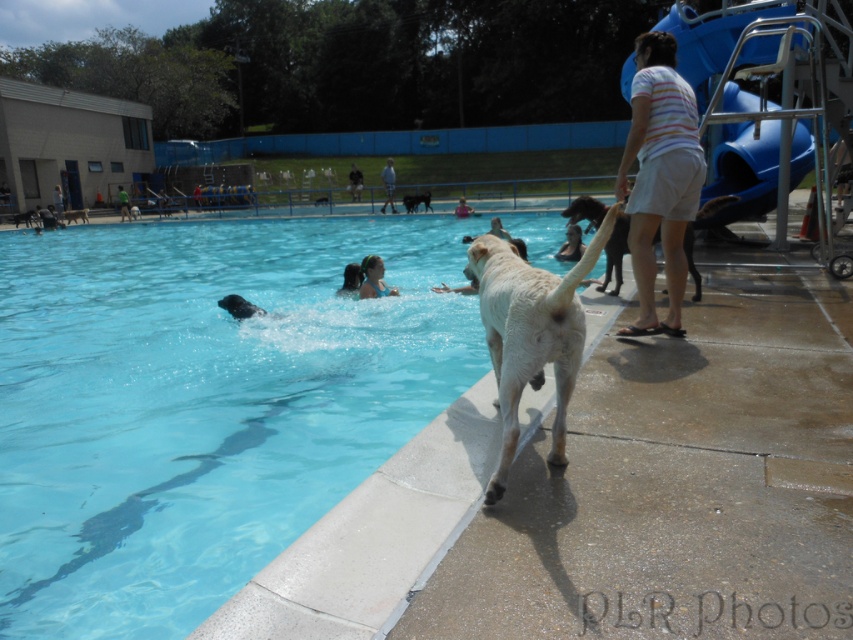
Between light brown fur at upper right and dark blue shirt at upper center, which one has less height?

Standing shorter between the two is light brown fur at upper right.

Does light brown fur at upper right appear on the right side of dark blue shirt at upper center?

Yes, light brown fur at upper right is to the right of dark blue shirt at upper center.

What do you see at coordinates (614, 252) in the screenshot?
I see `light brown fur at upper right` at bounding box center [614, 252].

Image resolution: width=853 pixels, height=640 pixels. Identify the location of light brown fur at upper right. (614, 252).

Is black fur dog at upper center behind white fur dog at upper left?

No, black fur dog at upper center is closer to the viewer.

Does black fur dog at upper center have a greater width compared to white fur dog at upper left?

In fact, black fur dog at upper center might be narrower than white fur dog at upper left.

The image size is (853, 640). Find the location of `black fur dog at upper center`. black fur dog at upper center is located at coordinates (416, 202).

Identify the location of black fur dog at upper center. The height and width of the screenshot is (640, 853). (416, 202).

Who is taller, smooth skin person at upper center or black fur dog at upper center?

black fur dog at upper center

Is smooth skin person at upper center wider than black fur dog at upper center?

In fact, smooth skin person at upper center might be narrower than black fur dog at upper center.

What do you see at coordinates (373, 278) in the screenshot? I see `smooth skin person at upper center` at bounding box center [373, 278].

Locate an element on the screen. This screenshot has height=640, width=853. smooth skin person at upper center is located at coordinates (373, 278).